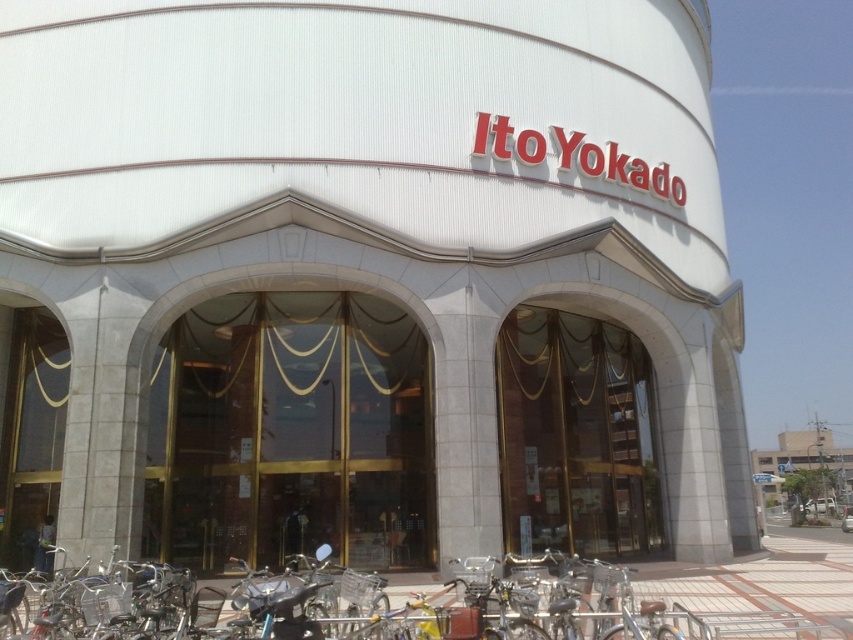
You are standing in front of the white glass building at center and want to park your silver metallic bicycle at lower center. Considering the space available, will the bicycle fit comfortably without touching the building or nearby objects?

The silver metallic bicycle at lower center has a lesser width compared to white glass building at center, so it should fit comfortably as it is narrower than the building. However, ensure there are no other nearby objects mentioned in the scene that might interfere with parking.

You are standing in front of the white glass building at center and want to park your silver metallic bicycle at lower center. Based on their heights, can the bicycle be parked without touching the building?

The silver metallic bicycle at lower center is not as tall as the white glass building at center, so it can be parked without touching the building.